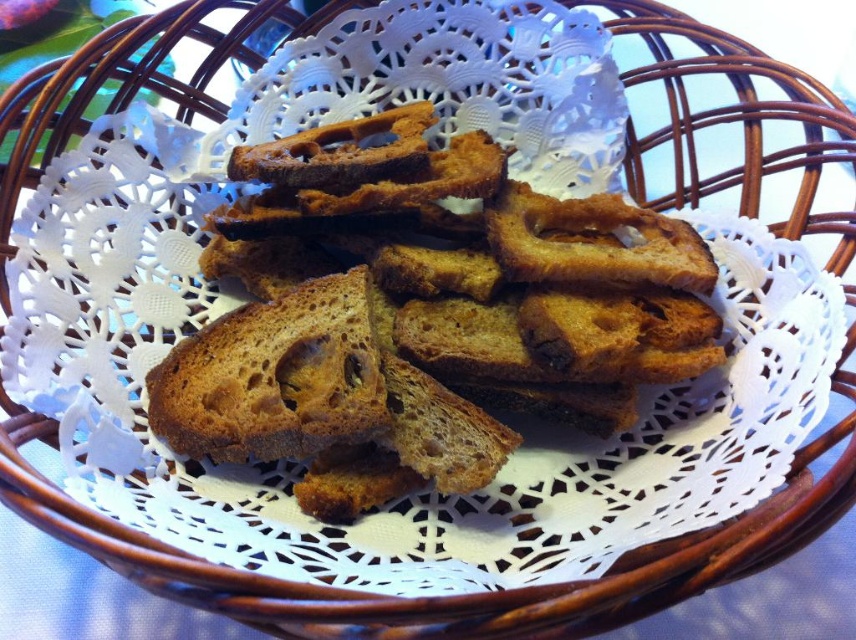
You are standing at the edge of the table where the rustic brown wicker basket is placed. You want to place a small herb plant between the two points marked as point (502, 397) and point (355, 413). Which point should you place the herb plant closer to so it is in front of both points?

To place the herb plant in front of both points, you should position it closer to point (355, 413) because point (502, 397) is behind point (355, 413), making the latter the closer one to the front.